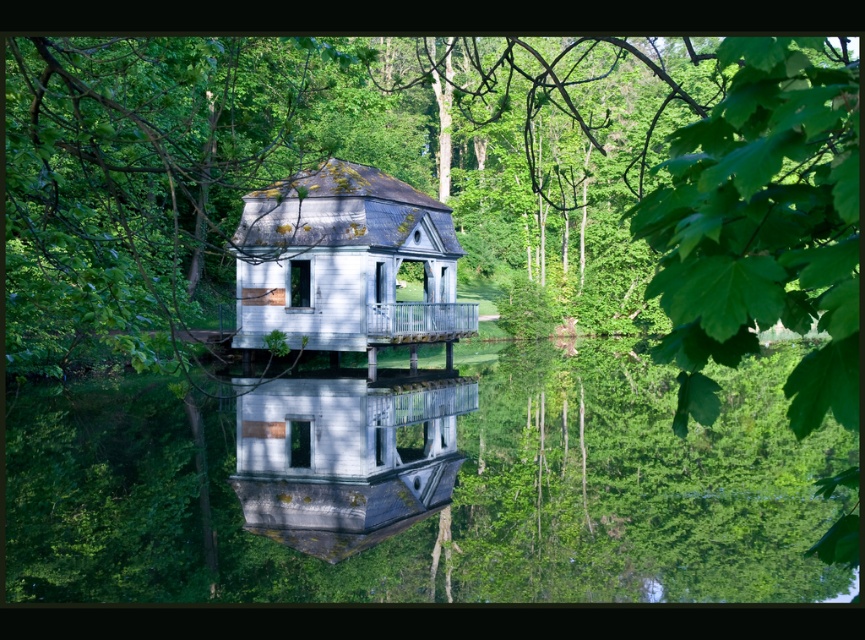
In the scene shown: Is transparent water at center above white matte house at center?

Yes, transparent water at center is above white matte house at center.

Is point (101, 387) more distant than point (267, 516)?

That is True.

In order to click on transparent water at center in this screenshot , I will do `click(580, 496)`.